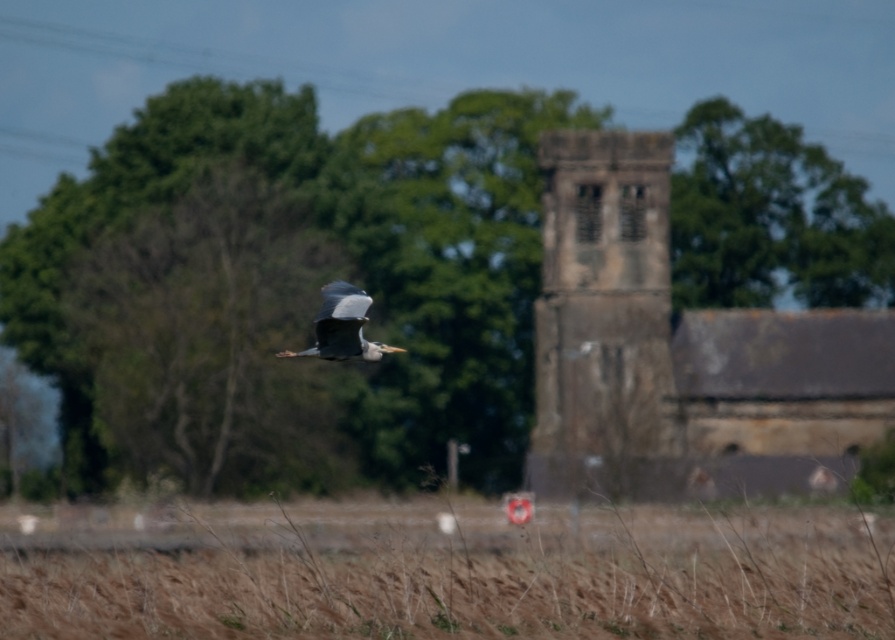
Is brown grass at lower center thinner than stone textured church tower at center?

No.

Is brown grass at lower center bigger than stone textured church tower at center?

Yes.

What are the coordinates of `brown grass at lower center` in the screenshot? It's located at (448, 570).

This screenshot has width=895, height=640. Find the location of `brown grass at lower center`. brown grass at lower center is located at coordinates (448, 570).

Is green leafy tree at upper center below gray feathered bird at center?

Actually, green leafy tree at upper center is above gray feathered bird at center.

Describe the element at coordinates (771, 218) in the screenshot. I see `green leafy tree at upper center` at that location.

Who is more distant from viewer, (680, 291) or (318, 339)?

Point (680, 291)

Locate an element on the screen. green leafy tree at upper center is located at coordinates (771, 218).

Can you confirm if brown grass at lower center is positioned above gray feathered bird at center?

No.

Locate an element on the screen. brown grass at lower center is located at coordinates (448, 570).

Between point (237, 589) and point (354, 285), which one is positioned in front?

Point (354, 285)

Locate an element on the screen. The height and width of the screenshot is (640, 895). brown grass at lower center is located at coordinates (448, 570).